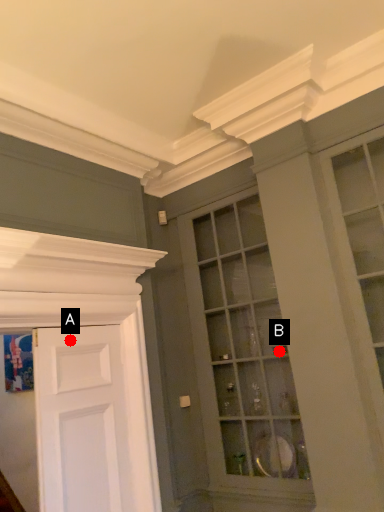
Question: Two points are circled on the image, labeled by A and B beside each circle. Among these points, which one is farthest from the camera?

Choices:
 (A) A is further
 (B) B is further

Answer: (B)